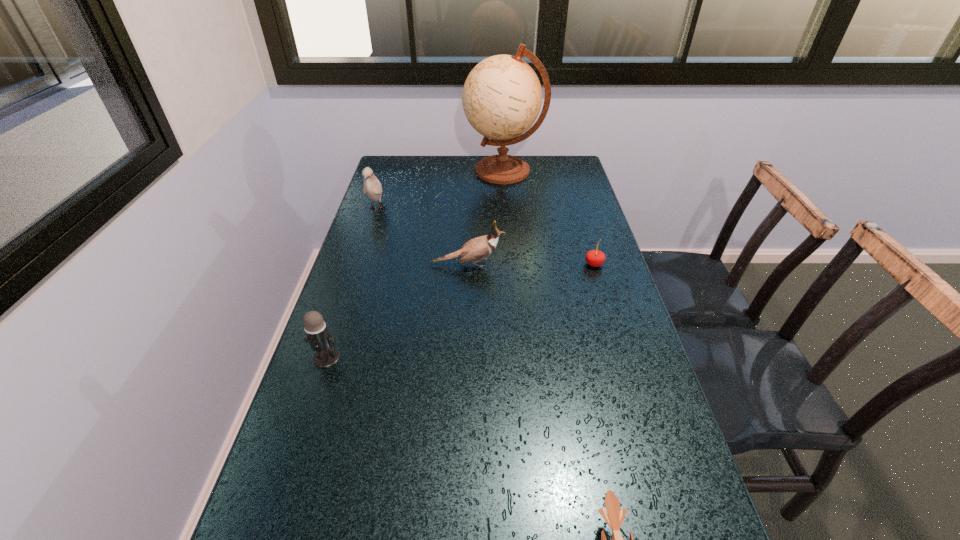
Where is `vacant space at the left edge`? Image resolution: width=960 pixels, height=540 pixels. vacant space at the left edge is located at coordinates (357, 268).

The image size is (960, 540). In the image, there is a desktop. Find the location of `vacant space at the right edge`. vacant space at the right edge is located at coordinates (565, 213).

Identify the location of free space at the far left corner. Image resolution: width=960 pixels, height=540 pixels. (401, 168).

Where is `vacant space at the far right corner of the desktop`? The height and width of the screenshot is (540, 960). vacant space at the far right corner of the desktop is located at coordinates (542, 171).

I want to click on free area in between the tallest object and the second nearest object, so click(x=416, y=264).

The image size is (960, 540). Identify the location of free space between the rightmost object and the microphone. (461, 311).

The height and width of the screenshot is (540, 960). What are the coordinates of `free space between the second farthest bird and the microphone` in the screenshot? It's located at (397, 311).

Identify the location of empty space that is in between the second farthest bird and the farthest bird. This screenshot has width=960, height=540. (421, 237).

Image resolution: width=960 pixels, height=540 pixels. In order to click on object that can be found as the fifth closest to the rightmost object in this screenshot , I will do `click(320, 340)`.

You are a GUI agent. You are given a task and a screenshot of the screen. Output one action in this format:
    pyautogui.click(x=<x>, y=<y>)
    Task: Click on the object identified as the closest to the globe
    The height and width of the screenshot is (540, 960).
    Given the screenshot: What is the action you would take?
    pyautogui.click(x=372, y=187)